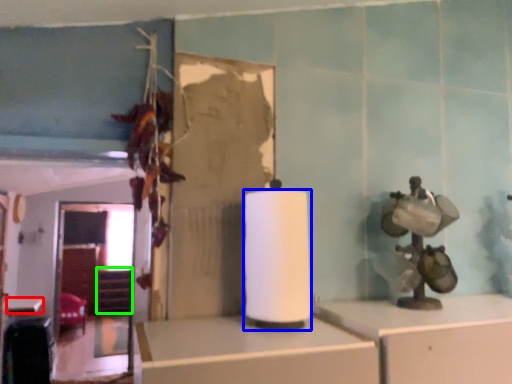
Question: Based on their relative distances, which object is farther from table (highlighted by a red box)? Choose from paper towel (highlighted by a blue box) and shelf (highlighted by a green box).

Choices:
 (A) paper towel
 (B) shelf

Answer: (A)